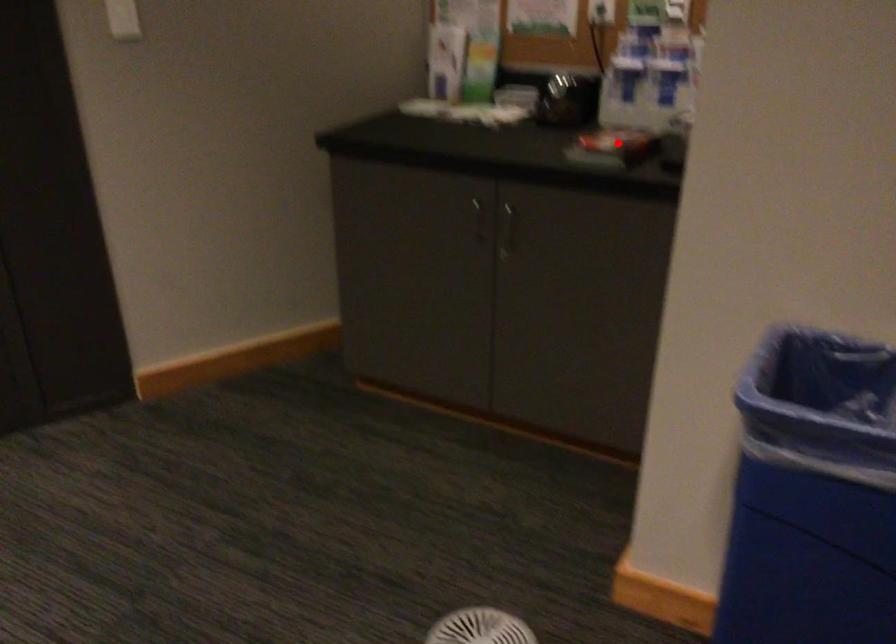
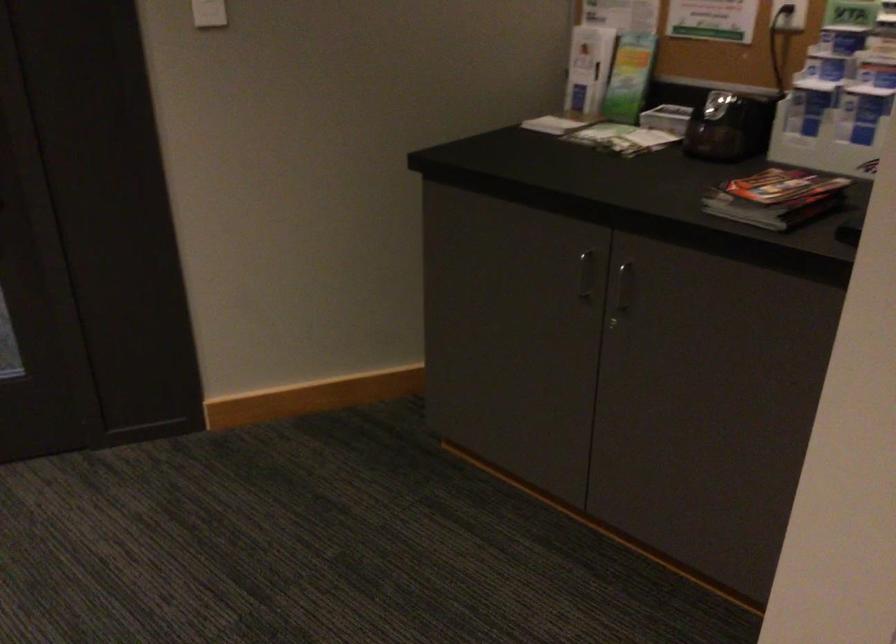
Question: A red point is marked in image1. In image2, is the corresponding 3D point closer to the camera or farther? Reply with the corresponding letter.

Choices:
 (A) The corresponding 3D point is closer.
 (B) The corresponding 3D point is farther.

Answer: (A)